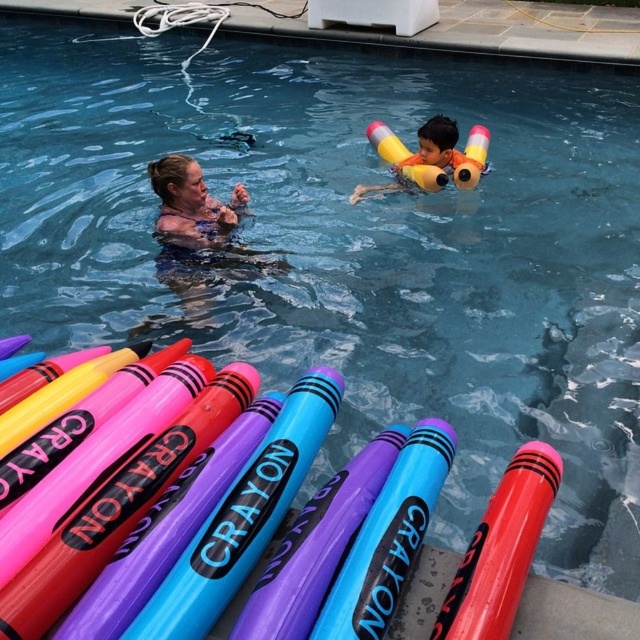
Question: Among these objects, which one is nearest to the camera?

Choices:
 (A) matte skin at center
 (B) yellow foam floaties at upper center

Answer: (A)

Question: Is yellow foam floaties at upper center to the left of matte skin at center from the viewer's perspective?

Choices:
 (A) no
 (B) yes

Answer: (A)

Question: Which point is farther to the camera?

Choices:
 (A) yellow foam floaties at upper center
 (B) matte skin at center

Answer: (A)

Question: Is yellow foam floaties at upper center positioned at the back of matte skin at center?

Choices:
 (A) yes
 (B) no

Answer: (A)

Question: Can you confirm if yellow foam floaties at upper center is positioned below matte skin at center?

Choices:
 (A) no
 (B) yes

Answer: (A)

Question: Among these objects, which one is nearest to the camera?

Choices:
 (A) matte skin at center
 (B) yellow foam floaties at upper center

Answer: (A)